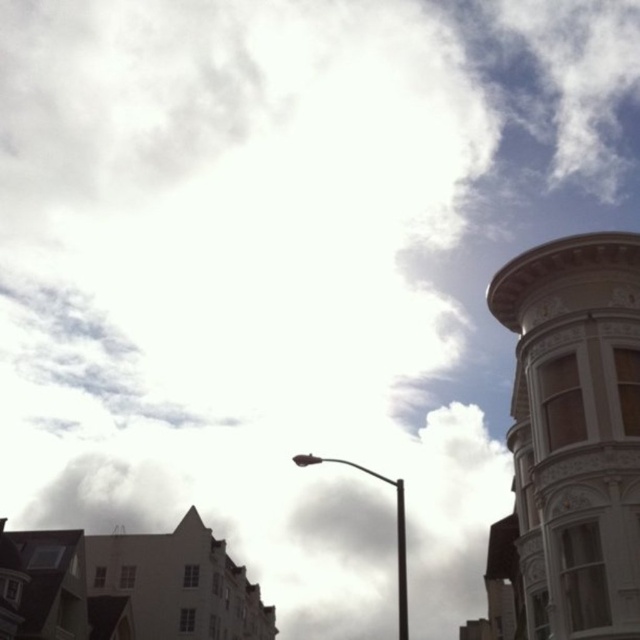
Who is lower down, metallic pole at center or black metal pole at center?

black metal pole at center is lower down.

Can you confirm if metallic pole at center is thinner than black metal pole at center?

No, metallic pole at center is not thinner than black metal pole at center.

The width and height of the screenshot is (640, 640). Describe the element at coordinates (396, 529) in the screenshot. I see `metallic pole at center` at that location.

Locate an element on the screen. metallic pole at center is located at coordinates (396, 529).